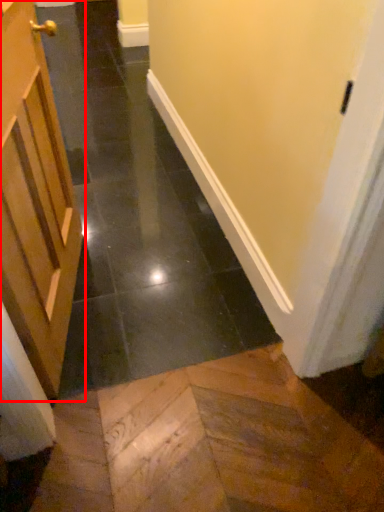
Question: From the image's perspective, what is the correct spatial relationship of door (annotated by the red box) in relation to path?

Choices:
 (A) below
 (B) above

Answer: (B)